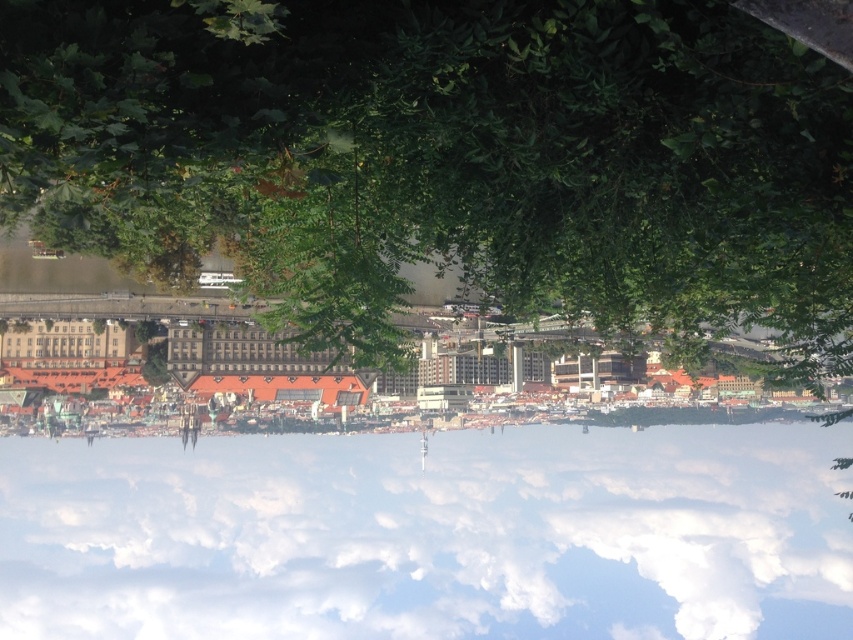
You are a pilot preparing to land a small airplane that requires a minimum of 200 meters of clearance from any obstacles. You notice a white fluffy cloud at center in your flight path. Based on the scene, can you safely pass under the cloud without hitting it?

The white fluffy cloud at center is 219.74 meters away from the viewer, which exceeds the required 200 meters of clearance. Therefore, the pilot can safely pass under the cloud at center as there is sufficient distance.

Based on the photo, you are a drone operator trying to capture a photo of the brown stone buildings at center from above. The white fluffy cloud at center is blocking your shot. What is the minimum distance you need to move the drone forward to get the buildings fully in frame without the cloud?

The minimum distance to move the drone forward is 57.56 meters to ensure the white fluffy cloud at center is no longer blocking the brown stone buildings at center.

You are a city planner reviewing this aerial view of a city. You notice the white fluffy cloud at center and the brown stone buildings at center. Which of these two objects would cast a longer shadow during midday when the sun is directly overhead?

The white fluffy cloud at center would cast a longer shadow because it has a larger size compared to the brown stone buildings at center.